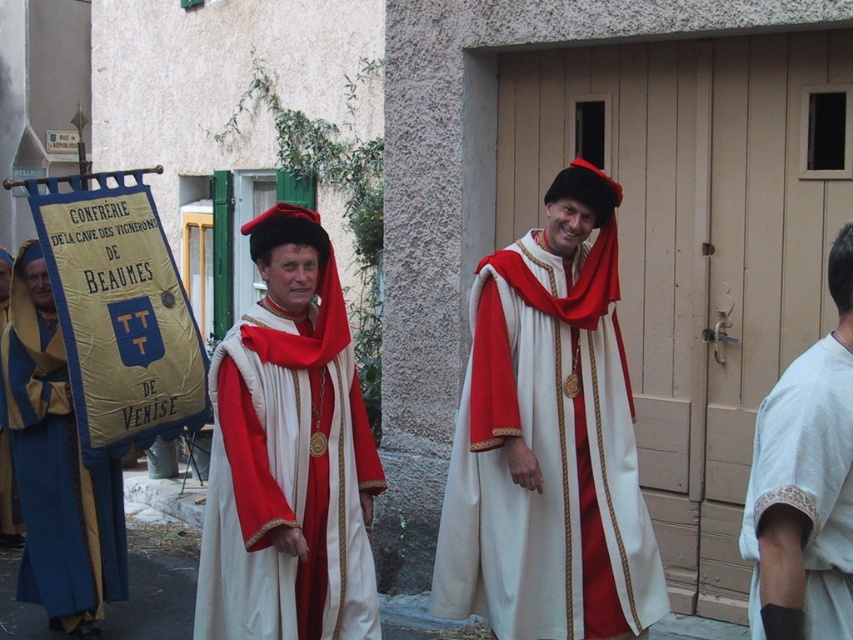
Question: Does matte white robe at center appear on the right side of white cotton shirt at right?

Choices:
 (A) yes
 (B) no

Answer: (B)

Question: Which point is farther from the camera taking this photo?

Choices:
 (A) (778, 435)
 (B) (606, 547)
 (C) (222, 416)

Answer: (B)

Question: Which of the following is the closest to the observer?

Choices:
 (A) matte gold robe at left
 (B) matte white robe at center
 (C) matte red velvet hat at center

Answer: (C)

Question: Which object is the farthest from the white cotton shirt at right?

Choices:
 (A) matte red velvet hat at center
 (B) matte white robe at center

Answer: (A)

Question: Is matte white robe at center positioned in front of white cotton shirt at right?

Choices:
 (A) no
 (B) yes

Answer: (A)

Question: Does matte white robe at center appear over matte red velvet hat at center?

Choices:
 (A) yes
 (B) no

Answer: (A)